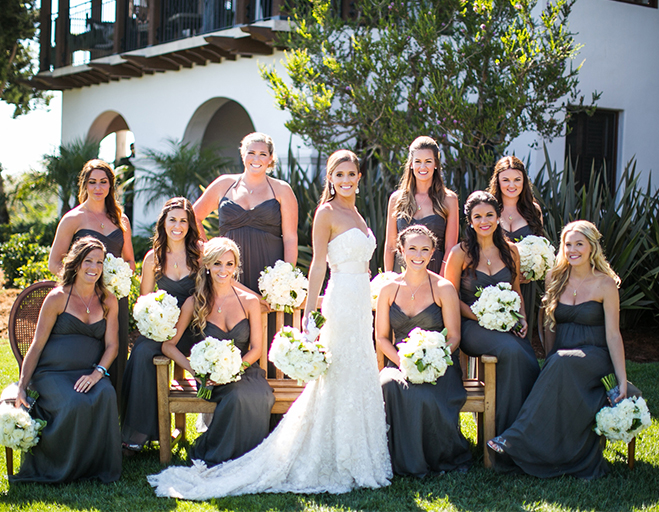
Find the location of a particular element. This screenshot has width=659, height=512. flower bouquets is located at coordinates (155, 322), (119, 269), (18, 433), (219, 361), (296, 351), (289, 281), (436, 364), (498, 308), (534, 265), (623, 420).